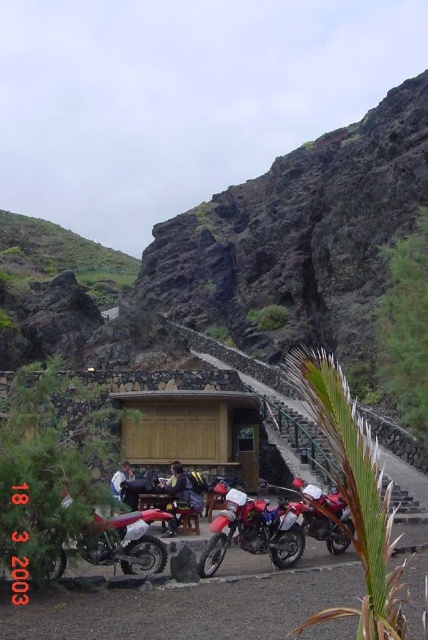
You are standing at the shelter and want to take a photo of the two points marked in the image. Which point, point (288, 560) or point (124, 544), will appear closer to the camera in the photo?

Point (124, 544) will appear closer to the camera in the photo because it is physically closer to the camera than point (288, 560), which is further away.

You are standing at the point with coordinates (252, 531) in the image. What object are you standing on?

You are standing on the red matte motorcycle at center.